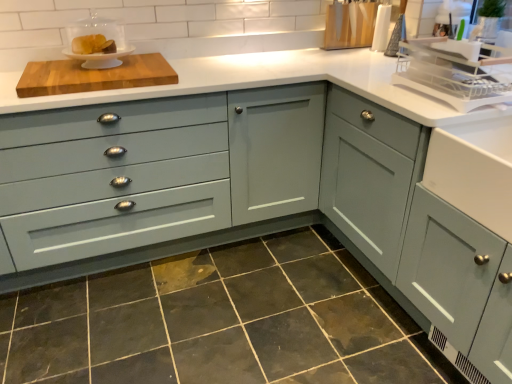
Question: Is matte gray cabinet at right, which is the 2th cabinetry in left-to-right order, in front of or behind wooden cutting board at upper left in the image?

Choices:
 (A) behind
 (B) front

Answer: (B)

Question: Considering the positions of matte gray cabinet at right, which is the 2th cabinetry in left-to-right order, and wooden cutting board at upper left in the image, is matte gray cabinet at right, which is the 2th cabinetry in left-to-right order, bigger or smaller than wooden cutting board at upper left?

Choices:
 (A) big
 (B) small

Answer: (A)

Question: Considering the real-world distances, which object is closest to the wooden cutting board at upper left?

Choices:
 (A) wooden knife block at upper right, acting as the second appliance starting from the right
 (B) dark gray granite at lower center
 (C) matte gray cabinet at right, the first cabinetry when ordered from right to left
 (D) matte gray cabinet at center, which is the second cabinetry from right to left
 (E) white plastic dish rack at upper right, placed as the third appliance when sorted from back to front

Answer: (D)

Question: Estimate the real-world distances between objects in this image. Which object is closer to the matte gray cabinet at center, which is the second cabinetry from right to left?

Choices:
 (A) wooden knife block at upper right, which is the third appliance in front-to-back order
 (B) white glossy cake stand at upper left, arranged as the second appliance when viewed from the front
 (C) matte gray cabinet at right, which is the 2th cabinetry in left-to-right order
 (D) wooden cutting board at upper left
 (E) dark gray granite at lower center

Answer: (D)